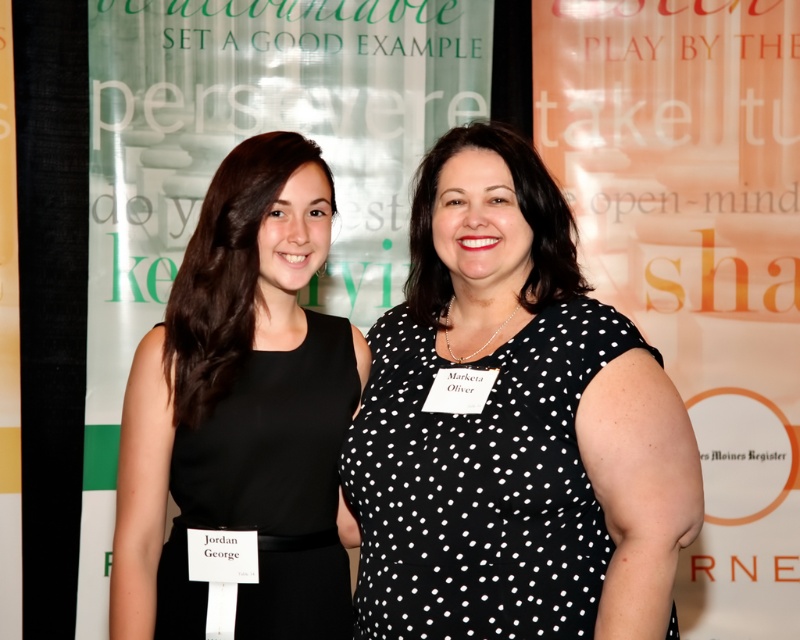
Which of these two, green fabric banner at upper center or black matte dress at left, stands shorter?

With less height is black matte dress at left.

Measure the distance between green fabric banner at upper center and camera.

green fabric banner at upper center is 2.78 meters from camera.

Locate an element on the screen. The image size is (800, 640). green fabric banner at upper center is located at coordinates [x=236, y=144].

Is black dotted dress at center below black matte dress at left?

No.

Who is more distant from viewer, (424,284) or (302,429)?

Point (424,284)

You are a GUI agent. You are given a task and a screenshot of the screen. Output one action in this format:
    pyautogui.click(x=<x>, y=<y>)
    Task: Click on the black dotted dress at center
    The height and width of the screenshot is (640, 800).
    Given the screenshot: What is the action you would take?
    pyautogui.click(x=512, y=426)

Does point (412, 483) come in front of point (216, 129)?

That is True.

Between black dotted dress at center and green fabric banner at upper center, which one has less height?

Standing shorter between the two is black dotted dress at center.

You are a GUI agent. You are given a task and a screenshot of the screen. Output one action in this format:
    pyautogui.click(x=<x>, y=<y>)
    Task: Click on the black dotted dress at center
    
    Given the screenshot: What is the action you would take?
    pyautogui.click(x=512, y=426)